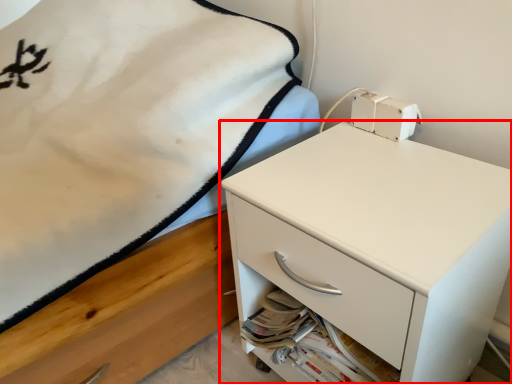
Question: From the image's perspective, what is the correct spatial positioning of chest of drawers (annotated by the red box) in reference to drawer?

Choices:
 (A) below
 (B) above

Answer: (B)